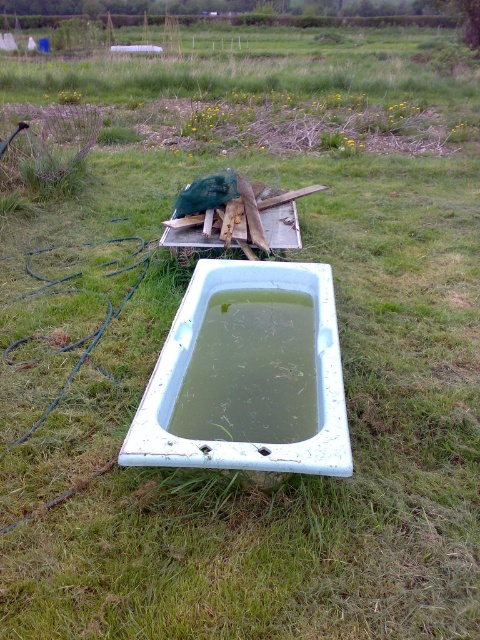
Is point (144, 456) farther from camera compared to point (310, 324)?

No, (144, 456) is in front of (310, 324).

Which is more to the left, white porcelain tub at center or green murky water at center?

green murky water at center

Does point (144, 452) lie in front of point (228, 317)?

Yes, point (144, 452) is in front of point (228, 317).

Locate an element on the screen. This screenshot has width=480, height=640. white porcelain tub at center is located at coordinates (190, 356).